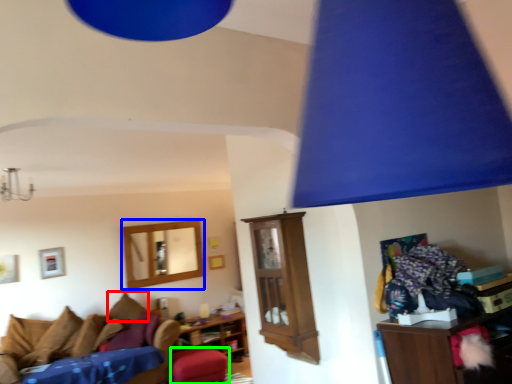
Question: Estimate the real-world distances between objects in this image. Which object is closer to pillow (highlighted by a red box), picture frame (highlighted by a blue box) or stool (highlighted by a green box)?

Choices:
 (A) picture frame
 (B) stool

Answer: (A)